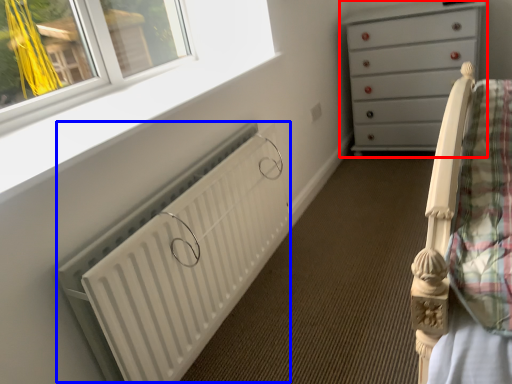
Question: Which point is further to the camera, chest of drawers (highlighted by a red box) or radiator (highlighted by a blue box)?

Choices:
 (A) chest of drawers
 (B) radiator

Answer: (A)